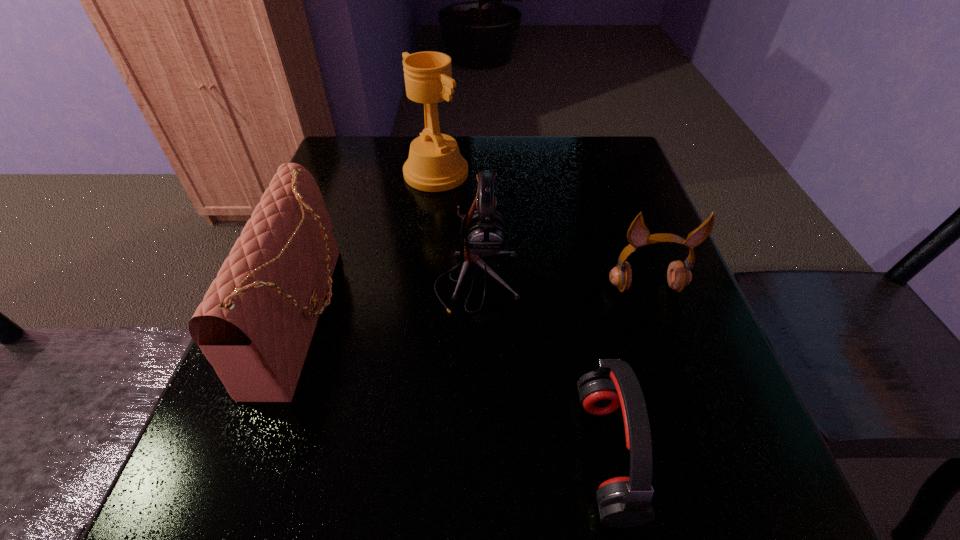
Find the location of a particular element. The width and height of the screenshot is (960, 540). vacant space at the right edge is located at coordinates (668, 255).

In the image, there is a desktop. Where is `vacant space at the far left corner`? vacant space at the far left corner is located at coordinates (339, 168).

Where is `vacant point located between the leftmost earphone and the tallest object`? vacant point located between the leftmost earphone and the tallest object is located at coordinates (456, 228).

This screenshot has width=960, height=540. I want to click on free space between the nearest earphone and the leftmost object, so click(x=455, y=385).

This screenshot has height=540, width=960. I want to click on free area in between the farthest object and the leftmost object, so click(371, 245).

Image resolution: width=960 pixels, height=540 pixels. Identify the location of empty space that is in between the award and the fourth object from left to right. pos(521,314).

Where is `blank region between the tallest earphone and the handbag`? Image resolution: width=960 pixels, height=540 pixels. blank region between the tallest earphone and the handbag is located at coordinates (391, 299).

The height and width of the screenshot is (540, 960). Identify the location of free space between the award and the rightmost earphone. 541,230.

The width and height of the screenshot is (960, 540). Find the location of `vacant area that lies between the rightmost object and the farthest object`. vacant area that lies between the rightmost object and the farthest object is located at coordinates (541, 230).

Identify the location of vacant area that lies between the handbag and the second earphone from right to left. (455, 385).